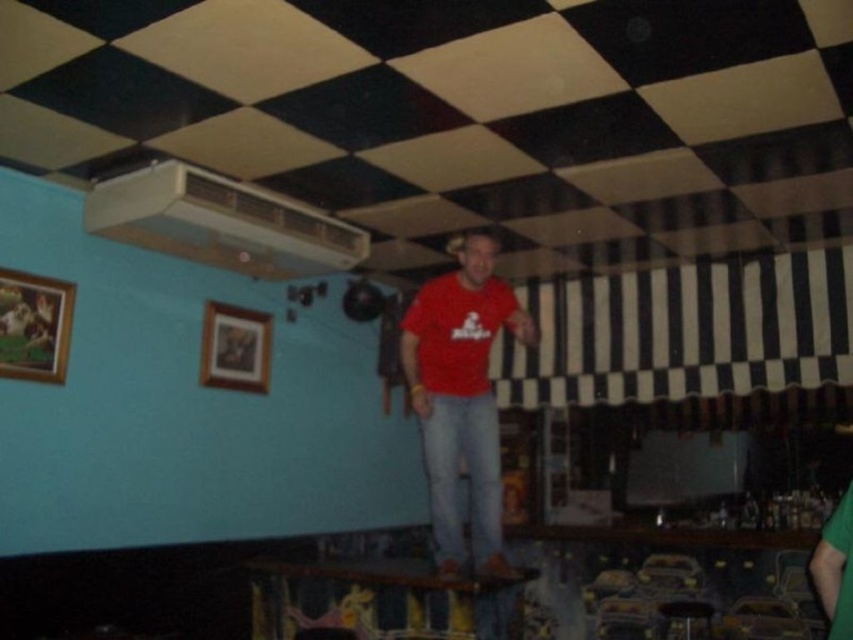
At what (x,y) coordinates should I click in order to perform the action: click on green fabric shirt at lower right. Please return your answer as a coordinate pair (x, y). Image resolution: width=853 pixels, height=640 pixels. Looking at the image, I should click on (834, 568).

Is point (815, 572) less distant than point (666, 609)?

Yes, it is in front of point (666, 609).

Between point (827, 605) and point (683, 614), which one is positioned in front?

Point (827, 605) is more forward.

Find the location of a particular element. This screenshot has width=853, height=640. green fabric shirt at lower right is located at coordinates (834, 568).

Who is more forward, (x=489, y=515) or (x=843, y=518)?

Point (x=843, y=518) is in front.

Which is more to the left, red matte shirt at center or green fabric shirt at lower right?

red matte shirt at center

This screenshot has width=853, height=640. What do you see at coordinates (461, 394) in the screenshot?
I see `red matte shirt at center` at bounding box center [461, 394].

The image size is (853, 640). Find the location of `red matte shirt at center`. red matte shirt at center is located at coordinates (461, 394).

Can you confirm if red matte shirt at center is thinner than wooden stool at lower right?

No.

Who is taller, red matte shirt at center or wooden stool at lower right?

Standing taller between the two is red matte shirt at center.

Measure the distance between point (450,547) and camera.

A distance of 3.79 meters exists between point (450,547) and camera.

Identify the location of red matte shirt at center. The image size is (853, 640). (461, 394).